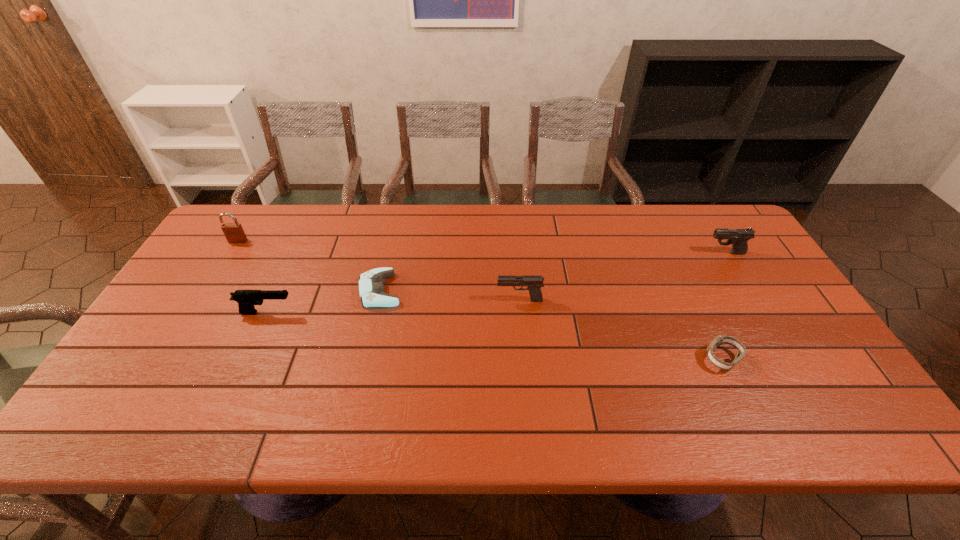
The image size is (960, 540). Identify the location of the shortest object. (371, 287).

At what (x,y) coordinates should I click in order to perform the action: click on the third object from left to right. Please return your answer as a coordinate pair (x, y). The height and width of the screenshot is (540, 960). Looking at the image, I should click on (371, 287).

What are the coordinates of `free space located 0.300m on the front-facing side of the padlock` in the screenshot? It's located at (193, 314).

Locate an element on the screen. This screenshot has height=540, width=960. free space located 0.100m at the barrel of the rightmost object is located at coordinates (674, 253).

This screenshot has width=960, height=540. In order to click on vacant space located 0.230m at the barrel of the rightmost object in this screenshot , I will do `click(633, 253)`.

This screenshot has height=540, width=960. Find the location of `free space located 0.160m at the barrel of the rightmost object`. free space located 0.160m at the barrel of the rightmost object is located at coordinates (655, 253).

Locate an element on the screen. Image resolution: width=960 pixels, height=540 pixels. vacant space located aim along the barrel of the second nearest pistol is located at coordinates (479, 300).

Identify the location of vacant space positioned 0.290m aim along the barrel of the second nearest pistol. (393, 300).

The width and height of the screenshot is (960, 540). Find the location of `vacant space situated 0.130m aim along the barrel of the second nearest pistol`. vacant space situated 0.130m aim along the barrel of the second nearest pistol is located at coordinates (450, 300).

Locate an element on the screen. free region located 0.350m on the front-facing side of the nearest pistol is located at coordinates (424, 313).